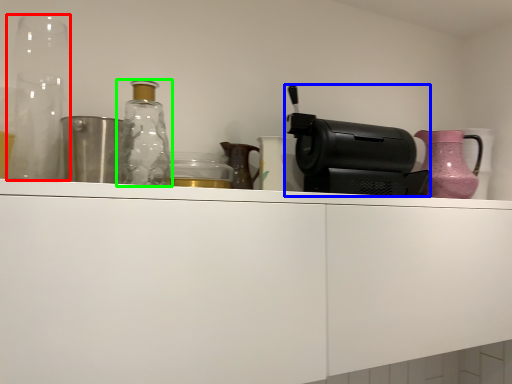
Question: Which object is positioned closest to glass vase (highlighted by a red box)? Select from coffee machine (highlighted by a blue box) and bottle (highlighted by a green box).

Choices:
 (A) coffee machine
 (B) bottle

Answer: (B)